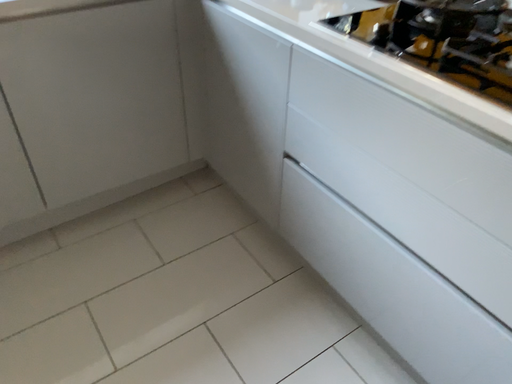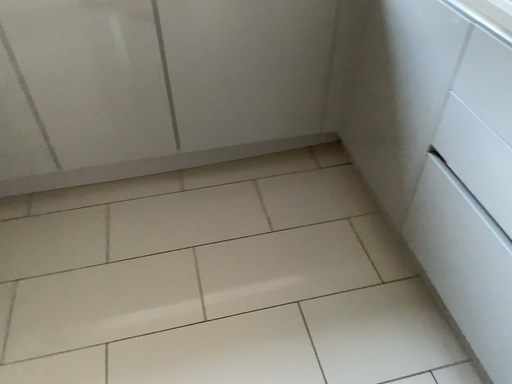
Question: Which way did the camera rotate in the video?

Choices:
 (A) rotated left
 (B) rotated right

Answer: (A)